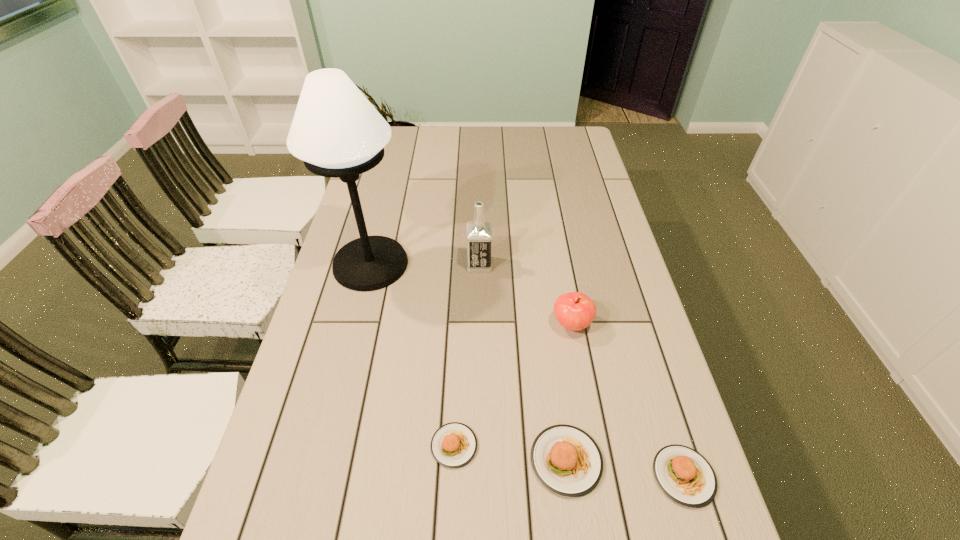
You are a GUI agent. You are given a task and a screenshot of the screen. Output one action in this format:
    pyautogui.click(x=<x>, y=<y>)
    Task: Click on the vacant area that satisfies the following two spatial constraints: 1. on the front label of the fourth tallest object; 2. on the right side of the vodka
    The width and height of the screenshot is (960, 540).
    Given the screenshot: What is the action you would take?
    pyautogui.click(x=479, y=461)

Find the location of `blank space that satisfies the following two spatial constraints: 1. on the back side of the rightmost object; 2. on the front label of the vodka`. blank space that satisfies the following two spatial constraints: 1. on the back side of the rightmost object; 2. on the front label of the vodka is located at coordinates tap(618, 265).

What are the coordinates of `free region that satisfies the following two spatial constraints: 1. on the front side of the fourth tallest object; 2. on the left side of the rightmost food` in the screenshot? It's located at (568, 476).